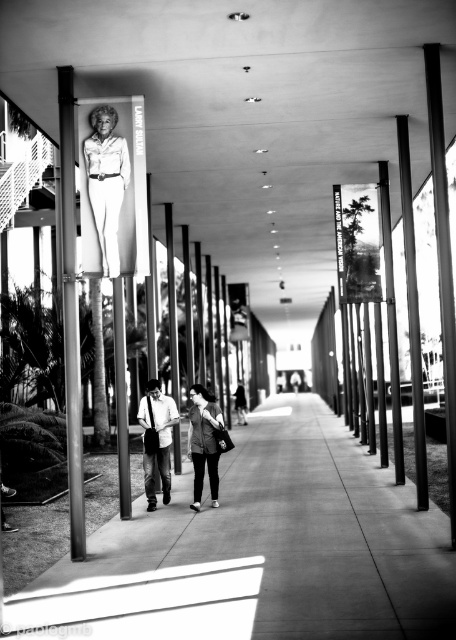
Find the location of a particular element. Image resolution: width=456 pixels, height=640 pixels. metallic pole at center is located at coordinates (120, 397).

Between metallic pole at center and dark gray jacket at center, which one appears on the right side from the viewer's perspective?

Positioned to the right is dark gray jacket at center.

In the scene shown: Measure the distance between point (x=114, y=362) and camera.

Point (x=114, y=362) is 19.20 meters from camera.

Find the location of `metallic pole at center`. metallic pole at center is located at coordinates (120, 397).

Who is more distant from viewer, (86, 182) or (233, 396)?

Point (233, 396)

Can you confirm if matte white statue at upper left is taller than dark gray jacket at center?

Correct, matte white statue at upper left is much taller as dark gray jacket at center.

This screenshot has width=456, height=640. What do you see at coordinates (105, 180) in the screenshot?
I see `matte white statue at upper left` at bounding box center [105, 180].

Where is `matte white statue at upper left`? The image size is (456, 640). matte white statue at upper left is located at coordinates (105, 180).

Describe the element at coordinates (71, 310) in the screenshot. I see `metallic pole at left` at that location.

Identify the location of metallic pole at left. (71, 310).

This screenshot has height=640, width=456. What are the coordinates of `metallic pole at left` in the screenshot? It's located at (71, 310).